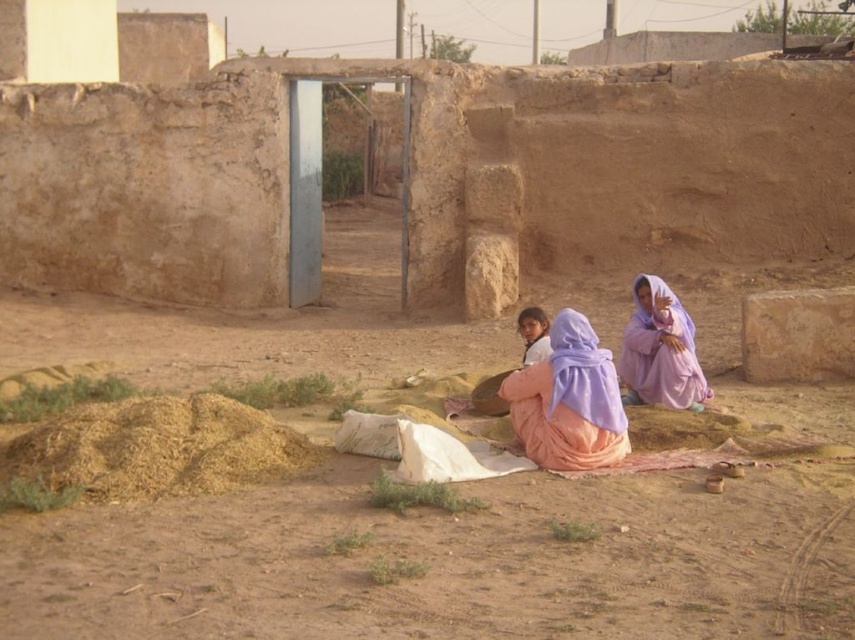
Question: Does purple fabric child at center appear over purple fabric at right?

Choices:
 (A) yes
 (B) no

Answer: (B)

Question: Does purple fabric child at center have a larger size compared to purple fabric at right?

Choices:
 (A) no
 (B) yes

Answer: (B)

Question: Which object appears closest to the camera in this image?

Choices:
 (A) purple fabric child at center
 (B) purple fabric at right

Answer: (A)

Question: In this image, where is purple fabric child at center located relative to purple fabric at right?

Choices:
 (A) below
 (B) above

Answer: (A)

Question: Which point is farther from the camera taking this photo?

Choices:
 (A) (575, 432)
 (B) (626, 328)

Answer: (B)